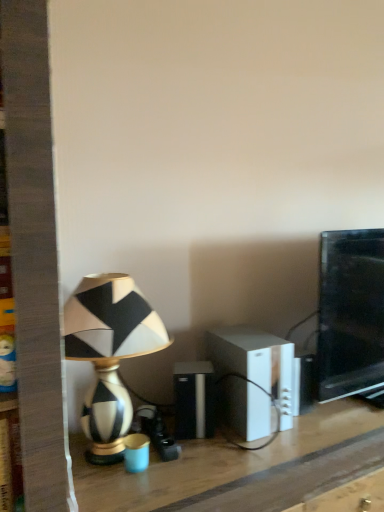
Question: Does white plastic speaker at center, which is the 2th speaker from left to right, contain black and white ceramic lamp at left?

Choices:
 (A) no
 (B) yes

Answer: (A)

Question: From a real-world perspective, is white plastic speaker at center, which is the 2th speaker from left to right, positioned under black and white ceramic lamp at left based on gravity?

Choices:
 (A) yes
 (B) no

Answer: (A)

Question: Is white plastic speaker at center, which is the 2th speaker from left to right, at the left side of black and white ceramic lamp at left?

Choices:
 (A) no
 (B) yes

Answer: (A)

Question: Does white plastic speaker at center, which is the 2th speaker from left to right, lie behind black and white ceramic lamp at left?

Choices:
 (A) yes
 (B) no

Answer: (A)

Question: From a real-world perspective, is white plastic speaker at center, acting as the first speaker starting from the right, physically above black and white ceramic lamp at left?

Choices:
 (A) yes
 (B) no

Answer: (B)

Question: From their relative heights in the image, would you say wooden table at center is taller or shorter than black and white ceramic lamp at left?

Choices:
 (A) tall
 (B) short

Answer: (A)

Question: From the image's perspective, is wooden table at center positioned above or below black and white ceramic lamp at left?

Choices:
 (A) below
 (B) above

Answer: (A)

Question: Does point (297, 500) appear closer or farther from the camera than point (104, 331)?

Choices:
 (A) farther
 (B) closer

Answer: (A)

Question: Is wooden table at center wider or thinner than black and white ceramic lamp at left?

Choices:
 (A) wide
 (B) thin

Answer: (A)

Question: Is black plastic speaker at center, which is the first speaker from left to right, inside the boundaries of black glossy monitor at right, or outside?

Choices:
 (A) inside
 (B) outside

Answer: (B)

Question: Is black plastic speaker at center, the 2th speaker from the right, to the left or to the right of black glossy monitor at right in the image?

Choices:
 (A) left
 (B) right

Answer: (A)

Question: Considering the positions of black plastic speaker at center, which is the first speaker from left to right, and black glossy monitor at right in the image, is black plastic speaker at center, which is the first speaker from left to right, taller or shorter than black glossy monitor at right?

Choices:
 (A) tall
 (B) short

Answer: (B)

Question: From the image's perspective, is black plastic speaker at center, the 2th speaker from the right, positioned above or below black glossy monitor at right?

Choices:
 (A) below
 (B) above

Answer: (A)

Question: In terms of height, does black and white ceramic lamp at left look taller or shorter compared to wooden table at center?

Choices:
 (A) tall
 (B) short

Answer: (B)

Question: Would you say black and white ceramic lamp at left is to the left or to the right of wooden table at center in the picture?

Choices:
 (A) right
 (B) left

Answer: (B)